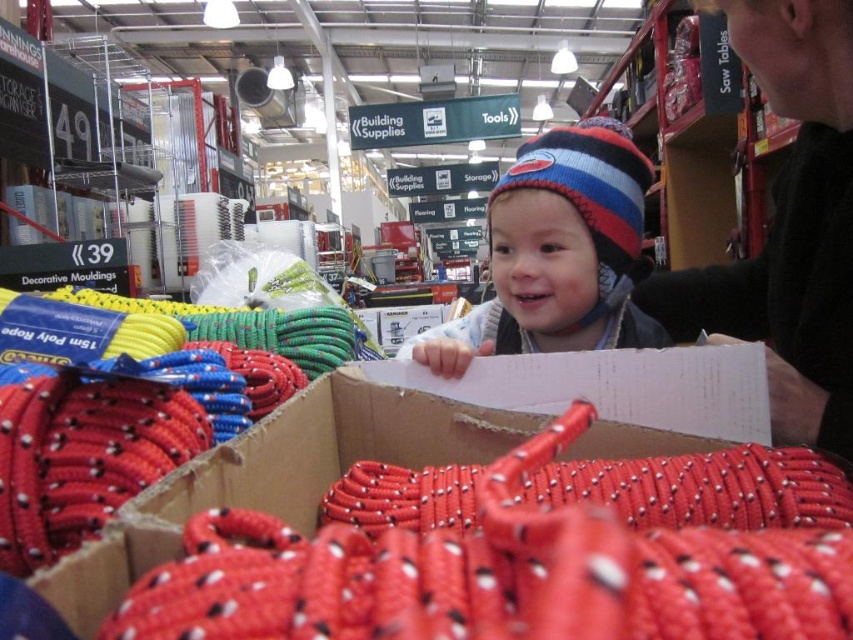
Is black sweater at upper right wider than striped knit hat at upper center?

Incorrect, black sweater at upper right's width does not surpass striped knit hat at upper center's.

Measure the distance from black sweater at upper right to striped knit hat at upper center.

8.25 inches

Describe the element at coordinates (788, 228) in the screenshot. The image size is (853, 640). I see `black sweater at upper right` at that location.

The height and width of the screenshot is (640, 853). Find the location of `black sweater at upper right`. black sweater at upper right is located at coordinates (788, 228).